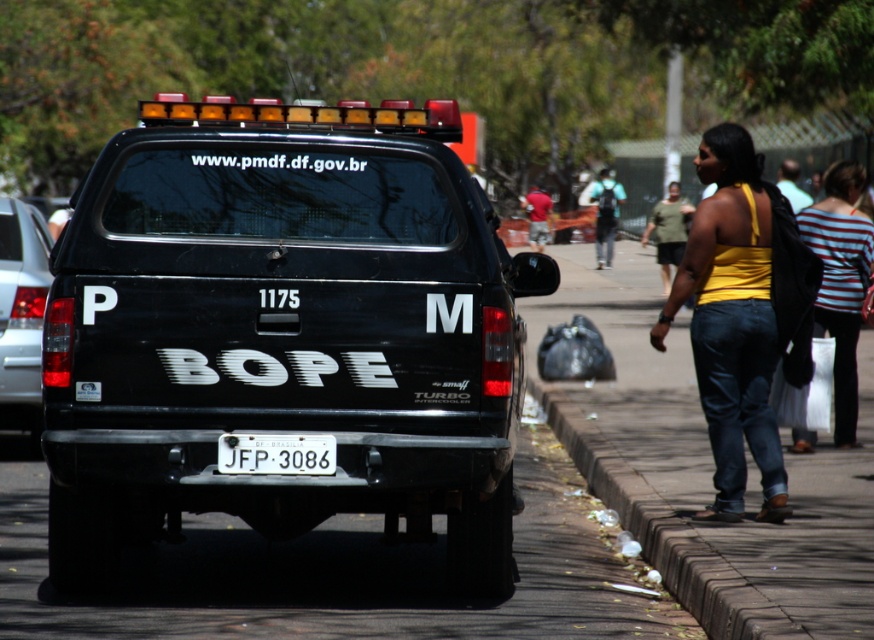
You are a photographer trying to capture a clear image of the white plastic license plate at center and the striped cotton shirt at center on the police vehicle. Since both are at the center, which object should you focus on to ensure the license plate is fully visible in the photo?

The striped cotton shirt at center has a larger width than the white plastic license plate at center, so focusing on the striped cotton shirt at center will ensure the license plate at center is fully visible since it is smaller and centered within the shirt.

You are a pedestrian standing on the sidewalk and see two black matte trucks parked on the street. The black matte truck at center and the black matte truck at left. Which truck is closer to the left side of the street?

The black matte truck at left is closer to the left side of the street because it is positioned to the left of the black matte truck at center.

You are a photographer standing in front of the black police vehicle. You want to take a photo that includes both the striped cotton shirt at center and the white plastic license plate at center. What is the minimum distance you need to move back to ensure both objects are in frame?

The striped cotton shirt at center and the white plastic license plate at center are 11.40 feet apart from each other. To include both in the photo, you need to move back at least 11.40 feet so that the camera can capture the entire distance between them.